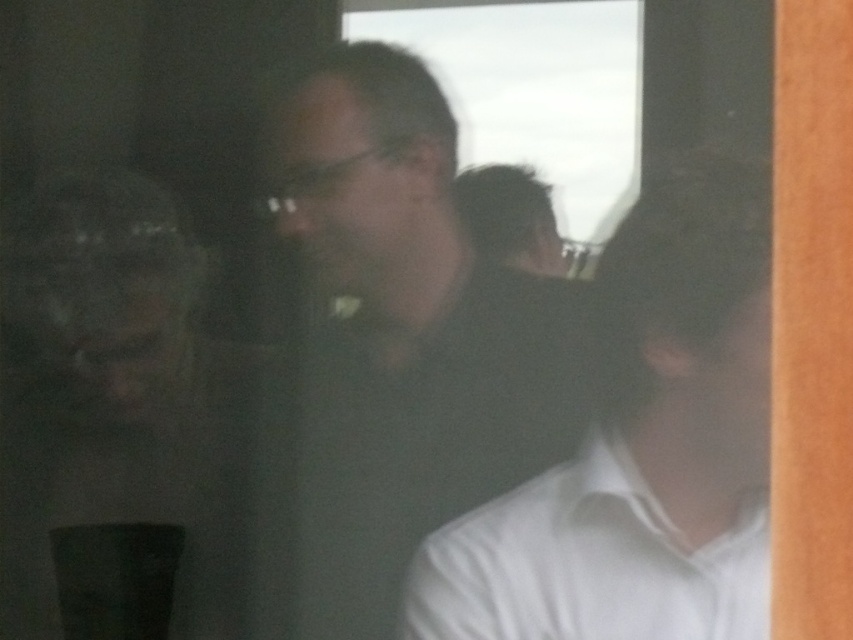
You are trying to determine which clothing item is wider between the matte black shirt at center and the white cotton dress shirt at lower right. Based on the scene description, which one is wider?

The white cotton dress shirt at lower right is wider than the matte black shirt at center.

You are observing through a window with reflections and need to locate the matte black shirt at center and the white cotton dress shirt at lower right. Which one is positioned higher in the image?

The matte black shirt at center is positioned higher than the white cotton dress shirt at lower right.

You are standing at the point marked as point (751, 522) and want to reach the door located at the opposite corner of the room. The room is rectangular, and you can only move along the walls. How far will you have to walk to reach the door?

The distance between the point marked as point (751, 522) and the door is 4.32 feet, so you will have to walk 4.32 feet to reach the door.